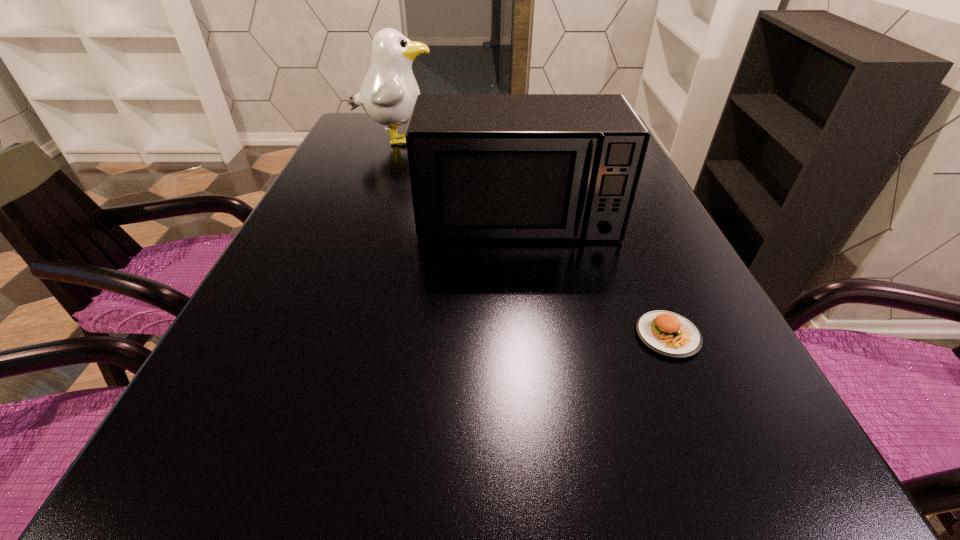
You are a GUI agent. You are given a task and a screenshot of the screen. Output one action in this format:
    pyautogui.click(x=<x>, y=<y>)
    Task: Click on the farthest object
    The image size is (960, 540).
    Given the screenshot: What is the action you would take?
    pyautogui.click(x=388, y=92)

Find the location of a particular element. gull is located at coordinates (388, 92).

Where is `the second nearest object`? The height and width of the screenshot is (540, 960). the second nearest object is located at coordinates (482, 166).

The height and width of the screenshot is (540, 960). I want to click on microwave_oven, so click(x=482, y=166).

The height and width of the screenshot is (540, 960). Identify the location of the shortest object. (667, 333).

You are a GUI agent. You are given a task and a screenshot of the screen. Output one action in this format:
    pyautogui.click(x=<x>, y=<y>)
    Task: Click on the food
    
    Given the screenshot: What is the action you would take?
    pyautogui.click(x=667, y=333)

The height and width of the screenshot is (540, 960). Identify the location of free space located on the beak of the farthest object. (528, 141).

Find the location of `free space located on the front-facing side of the microwave_oven`. free space located on the front-facing side of the microwave_oven is located at coordinates (527, 301).

Locate an element on the screen. The image size is (960, 540). vacant area located on the front of the food is located at coordinates (690, 388).

At what (x,y) coordinates should I click in order to perform the action: click on object at the far edge. Please return your answer as a coordinate pair (x, y). The width and height of the screenshot is (960, 540). Looking at the image, I should click on (388, 92).